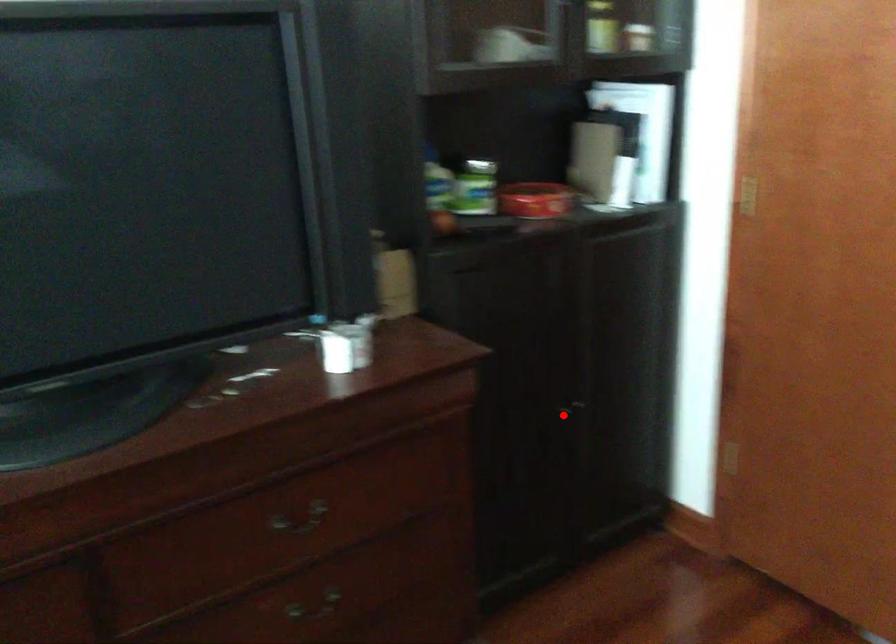
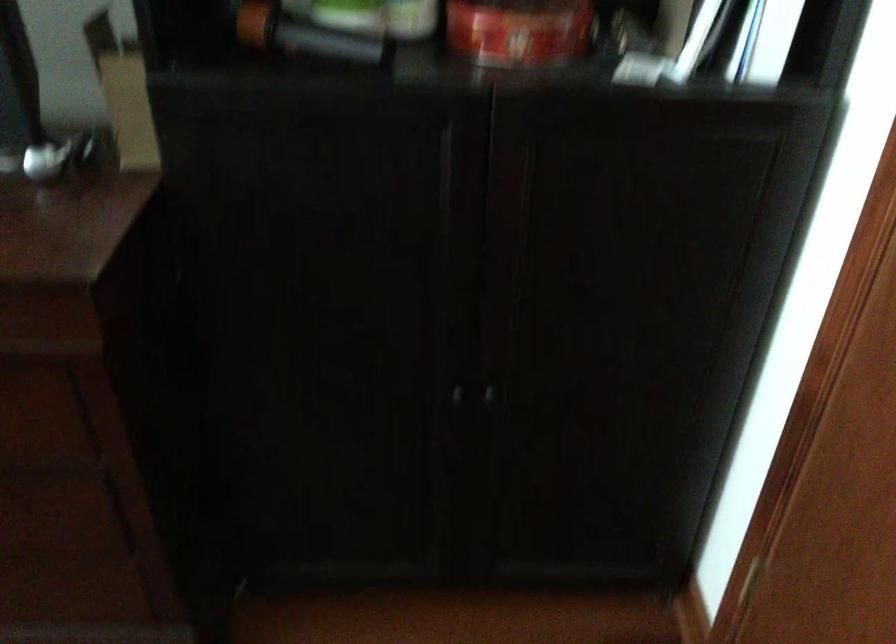
Question: A red point is marked in image1. In image2, is the corresponding 3D point closer to the camera or farther? Reply with the corresponding letter.

Choices:
 (A) The corresponding 3D point is closer.
 (B) The corresponding 3D point is farther.

Answer: (A)